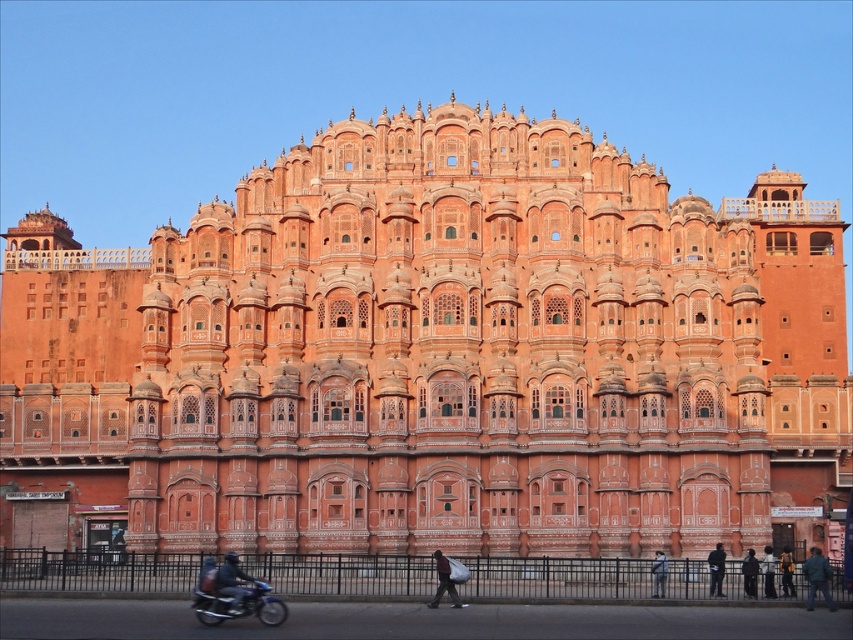
You are a tourist visiting Hawa Mahal and want to take a photo of the dark blue jeans at lower center. However, you notice a shiny blue motorcycle at lower left blocking your view. Can you move to the right to capture the jeans without the motorcycle in the frame?

The shiny blue motorcycle at lower left is positioned on the left side of dark blue jeans at lower center. Moving to the right would place the motorcycle behind you, allowing you to capture the dark blue jeans at lower center without obstruction.

You are a tourist visiting Hawa Mahal and want to take a photo of the iconic building. You have a dark gray fabric bag at center. Where should you place your bag in the photo to ensure it appears in the exact center of the image?

Place the dark gray fabric bag at center at the coordinates point (444, 580) to ensure it appears in the exact center of the image.

From the picture: You are a tourist visiting Hawa Mahal and you see a dark gray fabric bag at center and a dark blue fabric jacket at lower right. Which object is taller?

The dark gray fabric bag at center is much taller than the dark blue fabric jacket at lower right.